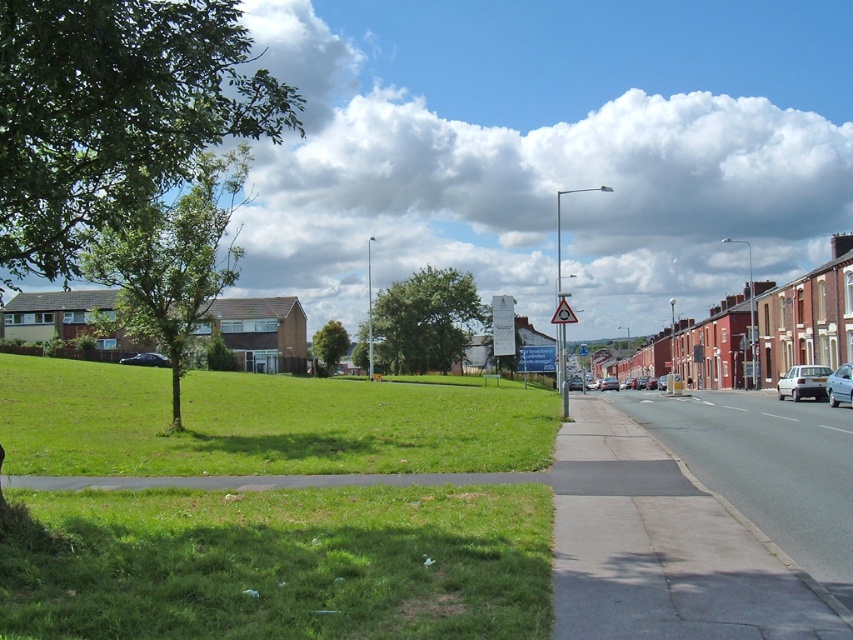
Question: Observing the image, what is the correct spatial positioning of gray concrete sidewalk at lower right in reference to metallic silver sedan at center-right?

Choices:
 (A) below
 (B) above

Answer: (B)

Question: Can you confirm if silver metallic car at center-right is smaller than metallic silver sedan at center-right?

Choices:
 (A) yes
 (B) no

Answer: (B)

Question: Which object is the farthest from the dark green metallic car at lower left?

Choices:
 (A) silver metallic car at center-right
 (B) metallic silver sedan at center-right
 (C) metallic silver sedan at right

Answer: (C)

Question: Which object is farther from the camera taking this photo?

Choices:
 (A) silver metallic car at center-right
 (B) metallic triangular warning sign at center

Answer: (A)

Question: Which point is closer to the camera?

Choices:
 (A) silver metallic car at center-right
 (B) gray concrete sidewalk at lower right

Answer: (B)

Question: Is metallic silver sedan at right smaller than dark green metallic car at lower left?

Choices:
 (A) yes
 (B) no

Answer: (A)